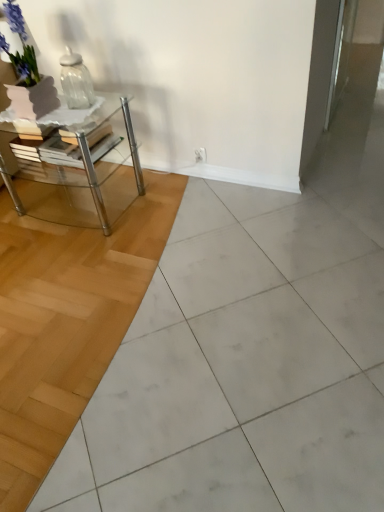
Describe the element at coordinates (76, 81) in the screenshot. I see `clear glass jar at upper left` at that location.

This screenshot has width=384, height=512. I want to click on clear glass jar at upper left, so click(76, 81).

Identify the location of white glossy ceramic tile at center. This screenshot has height=512, width=384. (241, 368).

Which is behind, point (91, 83) or point (53, 112)?

The point (91, 83) is behind.

From a real-world perspective, relative to clear glass table at left, is clear glass jar at upper left vertically above or below?

clear glass jar at upper left is above clear glass table at left.

Is clear glass jar at upper left facing away from clear glass table at left?

No, clear glass table at left is not at the back of clear glass jar at upper left.

Can you see clear glass jar at upper left touching clear glass table at left?

clear glass jar at upper left and clear glass table at left are clearly separated.

Looking at their sizes, would you say clear glass table at left is wider or thinner than white glossy ceramic tile at center?

clear glass table at left is thinner than white glossy ceramic tile at center.

Can you tell me how much clear glass table at left and white glossy ceramic tile at center differ in facing direction?

The facing directions of clear glass table at left and white glossy ceramic tile at center are 1.88 degrees apart.

Who is bigger, clear glass table at left or white glossy ceramic tile at center?

white glossy ceramic tile at center.

From the image's perspective, does clear glass jar at upper left appear higher than white glossy ceramic tile at center?

Yes.

From a real-world perspective, is clear glass jar at upper left physically above white glossy ceramic tile at center?

Yes, from a real-world perspective, clear glass jar at upper left is above white glossy ceramic tile at center.

Considering the relative positions of clear glass jar at upper left and white glossy ceramic tile at center in the image provided, is clear glass jar at upper left in front of white glossy ceramic tile at center?

No, it is not.

Between white glossy ceramic tile at center and clear glass table at left, which one is positioned in front?

white glossy ceramic tile at center is in front.

Which of these two, white glossy ceramic tile at center or clear glass table at left, stands shorter?

With less height is white glossy ceramic tile at center.

Is clear glass table at left surrounded by white glossy ceramic tile at center?

Definitely not — clear glass table at left is not inside white glossy ceramic tile at center.

Considering the positions of point (155, 370) and point (130, 154), is point (155, 370) closer or farther from the camera than point (130, 154)?

Point (155, 370) is closer to the camera than point (130, 154).

Is clear glass table at left surrounding clear glass jar at upper left?

No, clear glass table at left does not contain clear glass jar at upper left.

Is clear glass table at left not near clear glass jar at upper left?

That's not correct — clear glass table at left is a little close to clear glass jar at upper left.

Considering the sizes of clear glass table at left and clear glass jar at upper left in the image, is clear glass table at left taller or shorter than clear glass jar at upper left?

In the image, clear glass table at left appears to be taller than clear glass jar at upper left.

The height and width of the screenshot is (512, 384). I want to click on vase in front of the matte glass vase at upper left, so click(x=76, y=81).

Which of these two, matte glass vase at upper left or clear glass jar at upper left, is smaller?

Smaller between the two is clear glass jar at upper left.

Is matte glass vase at upper left located outside clear glass jar at upper left?

Yes, matte glass vase at upper left is not within clear glass jar at upper left.

From the image's perspective, is matte glass vase at upper left over clear glass jar at upper left?

Indeed, from the image's perspective, matte glass vase at upper left is shown above clear glass jar at upper left.

Which object is positioned more to the right, clear glass table at left or matte glass vase at upper left?

From the viewer's perspective, clear glass table at left appears more on the right side.

Is clear glass table at left bigger than matte glass vase at upper left?

Correct, clear glass table at left is larger in size than matte glass vase at upper left.

From the picture: From a real-world perspective, which is physically above, clear glass table at left or matte glass vase at upper left?

matte glass vase at upper left is physically above.

Is clear glass table at left closer to the viewer compared to matte glass vase at upper left?

Yes, clear glass table at left is closer to the viewer.

Where is `vase that appears behind the clear glass table at left`? vase that appears behind the clear glass table at left is located at coordinates (76, 81).

Image resolution: width=384 pixels, height=512 pixels. I want to click on table that appears below the white glossy ceramic tile at center (from the image's perspective), so click(78, 168).

Which object lies nearer to the anchor point white glossy ceramic tile at center, clear glass table at left or clear glass jar at upper left?

clear glass table at left is closer to white glossy ceramic tile at center.

Consider the image. Which object lies nearer to the anchor point clear glass jar at upper left, matte glass vase at upper left or clear glass table at left?

clear glass table at left is closer to clear glass jar at upper left.

In the scene shown: Which object lies nearer to the anchor point clear glass jar at upper left, white glossy ceramic tile at center or matte glass vase at upper left?

Based on the image, matte glass vase at upper left appears to be nearer to clear glass jar at upper left.

Considering their positions, is clear glass jar at upper left positioned further to white glossy ceramic tile at center than clear glass table at left?

clear glass jar at upper left is further to white glossy ceramic tile at center.

Considering their positions, is matte glass vase at upper left positioned further to white glossy ceramic tile at center than clear glass table at left?

matte glass vase at upper left is further to white glossy ceramic tile at center.

Estimate the real-world distances between objects in this image. Which object is closer to white glossy ceramic tile at center, clear glass jar at upper left or matte glass vase at upper left?

Among the two, clear glass jar at upper left is located nearer to white glossy ceramic tile at center.

From the image, which object appears to be farther from white glossy ceramic tile at center, matte glass vase at upper left or clear glass jar at upper left?

matte glass vase at upper left lies further to white glossy ceramic tile at center than the other object.

Which object lies nearer to the anchor point matte glass vase at upper left, clear glass jar at upper left or clear glass table at left?

clear glass jar at upper left is closer to matte glass vase at upper left.

I want to click on vase between white glossy ceramic tile at center and matte glass vase at upper left from front to back, so click(x=76, y=81).

Where is `table positioned between white glossy ceramic tile at center and matte glass vase at upper left from near to far`? This screenshot has height=512, width=384. table positioned between white glossy ceramic tile at center and matte glass vase at upper left from near to far is located at coordinates (78, 168).

Identify the location of table positioned between white glossy ceramic tile at center and clear glass jar at upper left from near to far. (78, 168).

Locate an element on the screen. This screenshot has height=512, width=384. vase between matte glass vase at upper left and clear glass table at left from top to bottom is located at coordinates (76, 81).